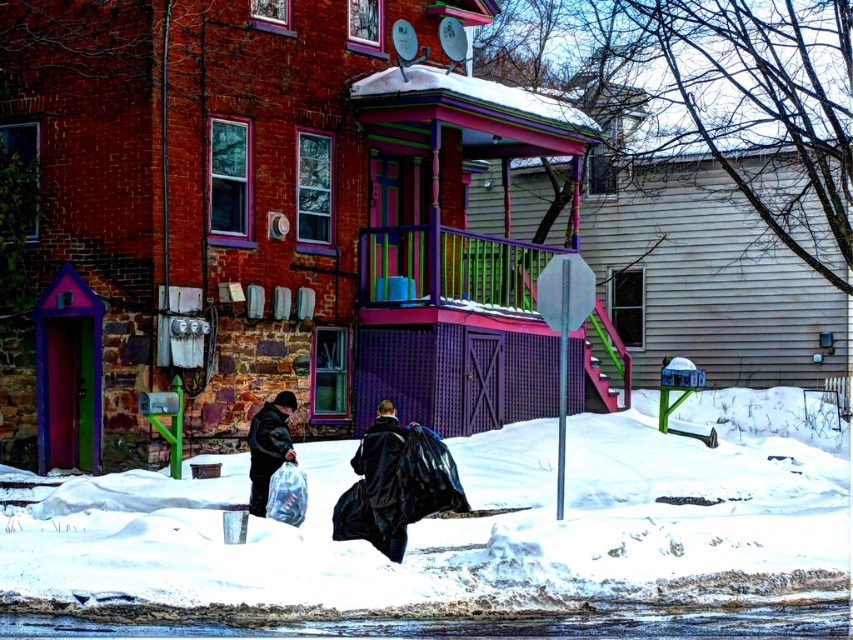
Question: Which object appears closest to the camera in this image?

Choices:
 (A) matte black jacket at lower left
 (B) white fluffy snow at lower center

Answer: (B)

Question: Does white fluffy snow at lower center lie in front of matte black jacket at lower left?

Choices:
 (A) yes
 (B) no

Answer: (A)

Question: Does white fluffy snow at lower center appear under matte black jacket at lower left?

Choices:
 (A) yes
 (B) no

Answer: (A)

Question: Among these points, which one is farthest from the camera?

Choices:
 (A) (553, 452)
 (B) (254, 481)

Answer: (A)

Question: Observing the image, what is the correct spatial positioning of white fluffy snow at lower center in reference to matte black jacket at lower left?

Choices:
 (A) above
 (B) below

Answer: (B)

Question: Which object appears farthest from the camera in this image?

Choices:
 (A) matte black jacket at lower left
 (B) white fluffy snow at lower center

Answer: (A)